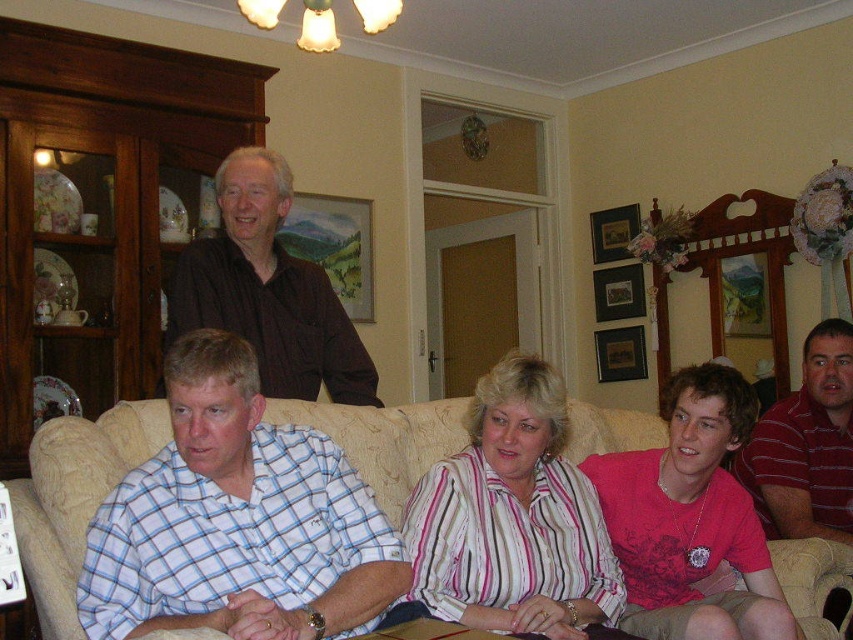
What do you see at coordinates (74, 497) in the screenshot? I see `beige fabric couch at center` at bounding box center [74, 497].

Locate an element on the screen. This screenshot has height=640, width=853. beige fabric couch at center is located at coordinates (74, 497).

Measure the distance between point (202, 420) and camera.

Point (202, 420) is 5.60 feet from camera.

Does white checkered shirt at lower left have a greater height compared to striped cotton shirt at center?

In fact, white checkered shirt at lower left may be shorter than striped cotton shirt at center.

Is point (270, 624) closer to camera compared to point (780, 502)?

Yes, point (270, 624) is closer to viewer.

Image resolution: width=853 pixels, height=640 pixels. Identify the location of white checkered shirt at lower left. (236, 520).

Does beige fabric couch at center have a larger size compared to striped cotton shirt at center?

Actually, beige fabric couch at center might be smaller than striped cotton shirt at center.

Who is more distant from viewer, (x=846, y=566) or (x=810, y=342)?

Point (x=810, y=342)

Image resolution: width=853 pixels, height=640 pixels. I want to click on beige fabric couch at center, so click(74, 497).